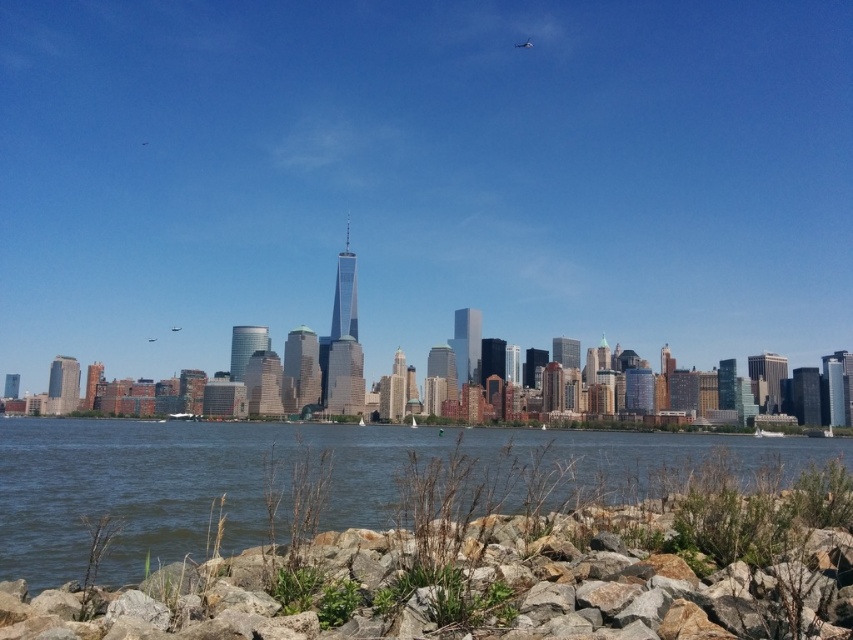
Which is more to the right, rocky shore at lower center or clear water at lower center?

rocky shore at lower center is more to the right.

Does rocky shore at lower center have a greater height compared to clear water at lower center?

Incorrect, rocky shore at lower center's height is not larger of clear water at lower center's.

Where is `rocky shore at lower center`? This screenshot has height=640, width=853. rocky shore at lower center is located at coordinates (477, 586).